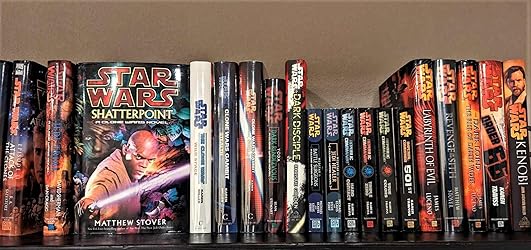
Where is `shadow on wall`? Image resolution: width=531 pixels, height=250 pixels. shadow on wall is located at coordinates (332, 73).